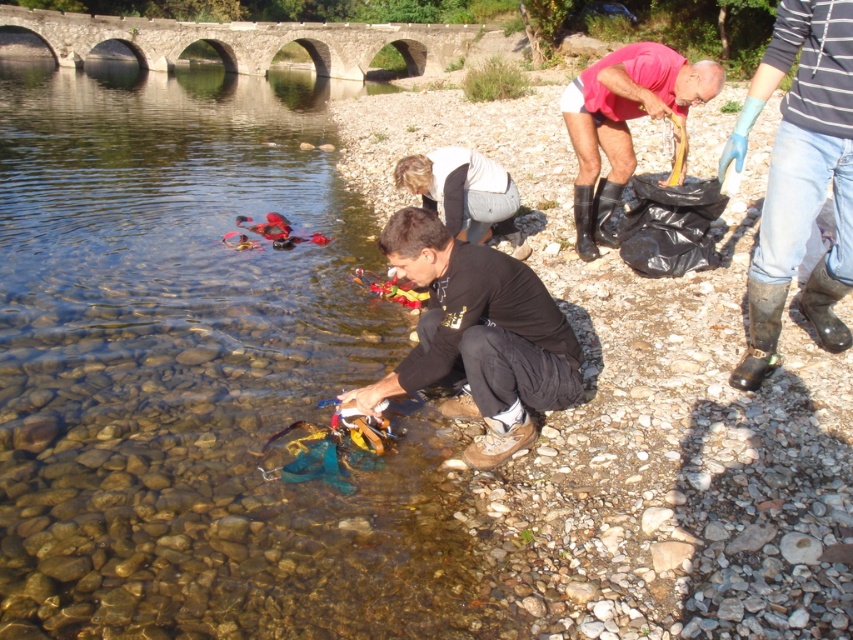
You are a drone operator trying to capture a photo of the clear stone creek at center and the black matte clothing at center. The camera has a maximum focus range of 10 feet. Will you be able to capture both objects in focus at the same time?

The clear stone creek at center and black matte clothing at center are 10.14 feet apart from each other. Since the maximum focus range is 10 feet, the distance between them exceeds the camera limit, so you cannot capture both in focus simultaneously.

You are a drone operator tasked with capturing aerial footage of the cleanup activity. The drone has a camera with a 100mm focal length lens, which has a narrow field of view. You need to ensure that the black matte clothing at center is in focus and occupies the central part of the frame. Given that the drone is currently positioned at point A, which is 10 meters above the riverbank, can you determine if adjusting the drone to point towards point B, located at coordinates 0.525, 0.563, will keep the black.

The black matte clothing at center is located at point (479,336), so adjusting the drone to point towards these coordinates will ensure it remains in focus and centered in the frame.